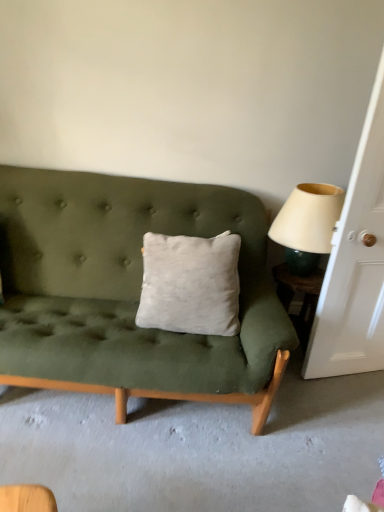
Describe the element at coordinates (355, 264) in the screenshot. I see `white wood door at right` at that location.

Describe the element at coordinates (299, 297) in the screenshot. This screenshot has height=512, width=384. I see `green glossy side table at right` at that location.

The height and width of the screenshot is (512, 384). In order to click on white wood door at right in this screenshot , I will do `click(355, 264)`.

How many degrees apart are the facing directions of white wood door at right and green glossy side table at right?

14.6 degrees.

Considering the relative sizes of white wood door at right and green glossy side table at right in the image provided, is white wood door at right smaller than green glossy side table at right?

Actually, white wood door at right might be larger than green glossy side table at right.

Is white wood door at right directly adjacent to green glossy side table at right?

No, white wood door at right is not making contact with green glossy side table at right.

Is white wood door at right inside the boundaries of green glossy side table at right, or outside?

white wood door at right lies outside green glossy side table at right.

Who is bigger, beige fabric lampshade at right or green glossy side table at right?

beige fabric lampshade at right is bigger.

Considering the points (293, 201) and (273, 271), which point is in front, point (293, 201) or point (273, 271)?

The point (293, 201) is closer.

Who is more distant, beige fabric lampshade at right or green glossy side table at right?

green glossy side table at right is further from the camera.

How many degrees apart are the facing directions of beige fabric lampshade at right and green glossy side table at right?

The facing directions of beige fabric lampshade at right and green glossy side table at right are 0.532 degrees apart.

Consider the image. How far apart are white wood door at right and beige fabric lampshade at right?

8.57 inches.

From the image's perspective, is white wood door at right above or below beige fabric lampshade at right?

Clearly, from the image's perspective, white wood door at right is above beige fabric lampshade at right.

From a real-world perspective, which object stands above the other?

From a 3D spatial view, white wood door at right is above.

Is beige fabric lampshade at right at the back of white wood door at right?

Correct, white wood door at right is looking away from beige fabric lampshade at right.

Is green glossy side table at right not near beige fabric lampshade at right?

No, there isn't a large distance between green glossy side table at right and beige fabric lampshade at right.

Does green glossy side table at right have a lesser height compared to beige fabric lampshade at right?

Incorrect, the height of green glossy side table at right does not fall short of that of beige fabric lampshade at right.

Which is behind, point (313, 281) or point (317, 203)?

The point (313, 281) is farther.

Considering the relative positions of green glossy side table at right and beige fabric lampshade at right in the image provided, is green glossy side table at right in front of beige fabric lampshade at right?

No, it is not.

Is green glossy side table at right aimed at white wood door at right?

No, green glossy side table at right is not turned towards white wood door at right.

Considering their positions, is green glossy side table at right located in front of or behind white wood door at right?

Visually, green glossy side table at right is located behind white wood door at right.

Considering the sizes of objects green glossy side table at right and white wood door at right in the image provided, who is smaller, green glossy side table at right or white wood door at right?

Smaller between the two is green glossy side table at right.

Is beige fabric lampshade at right to the right of white wood door at right from the viewer's perspective?

In fact, beige fabric lampshade at right is to the left of white wood door at right.

Between beige fabric lampshade at right and white wood door at right, which one has larger width?

With larger width is beige fabric lampshade at right.

The height and width of the screenshot is (512, 384). What are the coordinates of `table lamp below the white wood door at right (from the image's perspective)` in the screenshot? It's located at (307, 224).

Find the location of a particular element. door positioned vertically above the green glossy side table at right (from a real-world perspective) is located at coordinates (355, 264).

Find the location of a particular element. This screenshot has width=384, height=512. table lamp located above the green glossy side table at right (from the image's perspective) is located at coordinates (307, 224).

From the image, which object appears to be farther from green glossy side table at right, white wood door at right or beige fabric lampshade at right?

The object further to green glossy side table at right is white wood door at right.

From the image, which object appears to be nearer to beige fabric lampshade at right, white wood door at right or green glossy side table at right?

Among the two, white wood door at right is located nearer to beige fabric lampshade at right.

Looking at this image, when comparing their distances from green glossy side table at right, does beige fabric lampshade at right or white wood door at right seem further?

Based on the image, white wood door at right appears to be further to green glossy side table at right.

Considering their positions, is green glossy side table at right positioned closer to white wood door at right than beige fabric lampshade at right?

beige fabric lampshade at right.

Looking at the image, which one is located closer to beige fabric lampshade at right, green glossy side table at right or white wood door at right?

Based on the image, white wood door at right appears to be nearer to beige fabric lampshade at right.

Looking at the image, which one is located closer to white wood door at right, beige fabric lampshade at right or green glossy side table at right?

The object closer to white wood door at right is beige fabric lampshade at right.

Where is `table lamp between white wood door at right and green glossy side table at right along the z-axis`? table lamp between white wood door at right and green glossy side table at right along the z-axis is located at coordinates (307, 224).